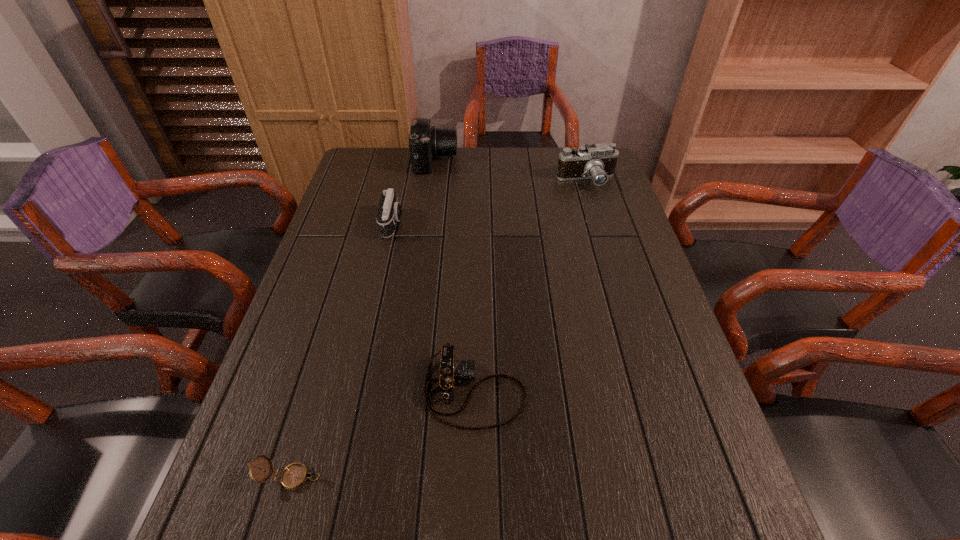
The image size is (960, 540). In order to click on vacant space located on the face of the nearest object in this screenshot , I will do `click(413, 477)`.

The width and height of the screenshot is (960, 540). I want to click on camera located in the left edge section of the desktop, so click(x=389, y=212).

This screenshot has width=960, height=540. What are the coordinates of `compass that is at the left edge` in the screenshot? It's located at (294, 476).

The height and width of the screenshot is (540, 960). Find the location of `object located at the right edge`. object located at the right edge is located at coordinates (597, 162).

The height and width of the screenshot is (540, 960). What are the coordinates of `object that is at the far right corner` in the screenshot? It's located at (597, 162).

The width and height of the screenshot is (960, 540). In order to click on free point at the far edge in this screenshot , I will do `click(545, 174)`.

Identify the location of vacant area at the left edge. (316, 320).

In the image, there is a desktop. Where is `vacant region at the right edge`? vacant region at the right edge is located at coordinates (613, 315).

Identify the location of vacant space at the far left corner of the desktop. (369, 161).

The image size is (960, 540). In order to click on free space that is in between the rightmost camera and the nearest camera in this screenshot , I will do `click(531, 286)`.